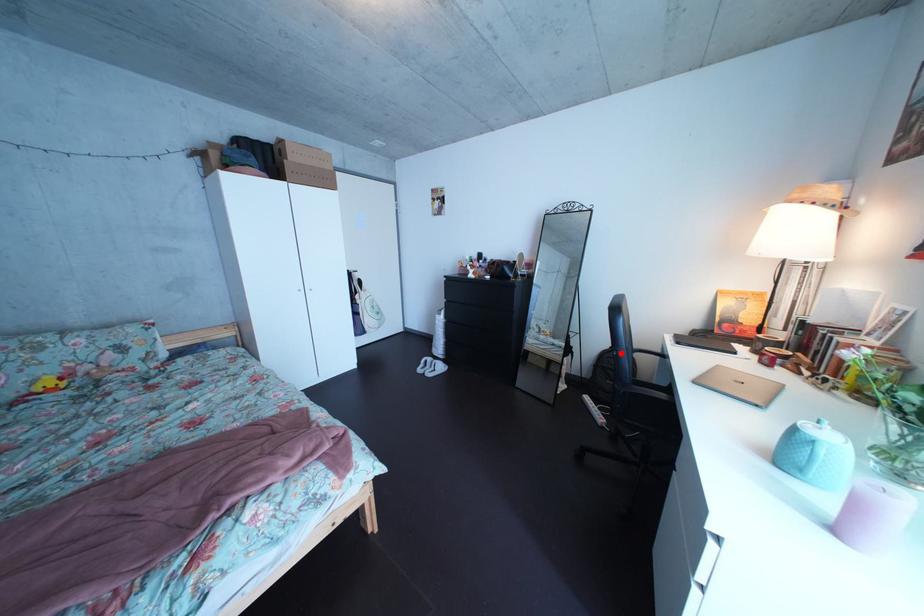
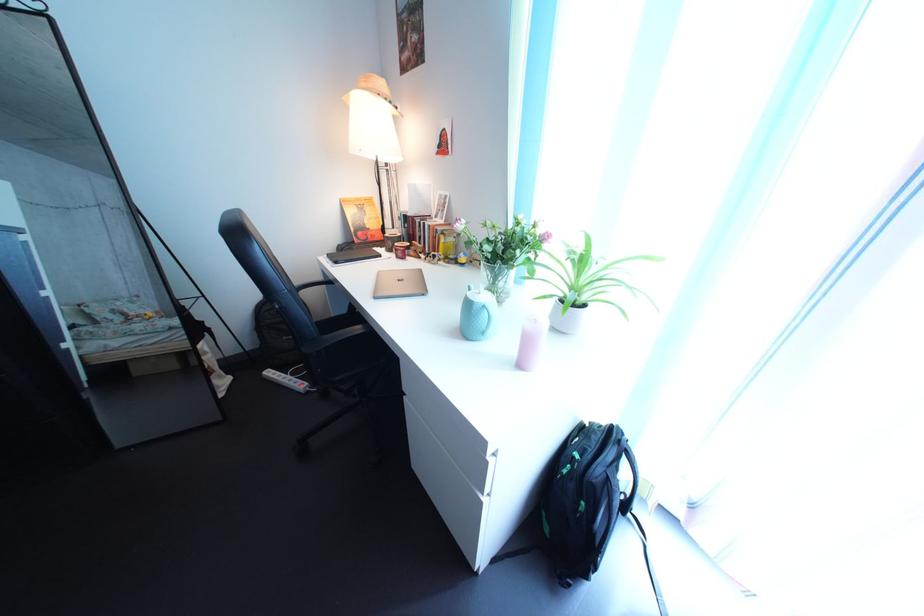
In the second image, find the point that corresponds to the highlighted location in the first image.

(272, 305)